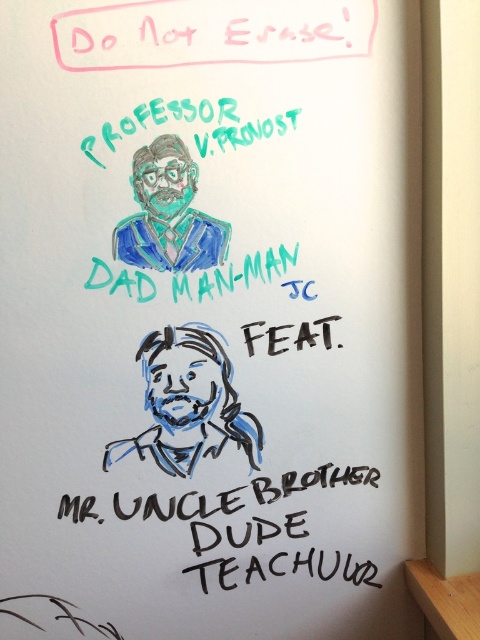
You are an artist who wants to add a new drawing to the whiteboard. The blue sketchy man at center and the black marker text at lower center are already present. Considering their sizes, which one can you expand more without overlapping them?

The blue sketchy man at center can be expanded more since it has a lesser width compared to the black marker text at lower center, allowing for additional space to grow without overlapping.

Based on the photo, you are standing in front of the whiteboard and notice the point labeled as coordinates. Can you tell me what object on the whiteboard is located at the point with coordinates (189, 403)?

The point at coordinates (189, 403) corresponds to the blue sketchy man at center.

You are standing in front of the whiteboard and want to read the black marker text at lower center without moving your head. Is it possible to read it clearly from your current position?

The black marker text at lower center is 3.54 feet away from the camera, so if you are standing at the camera position, you can read it clearly without moving your head as it is within a comfortable reading distance.